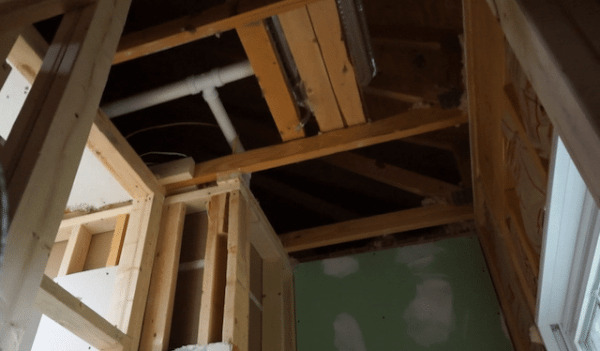
This screenshot has width=600, height=351. What are the coordinates of `sheetrock` in the screenshot? It's located at (97, 287).